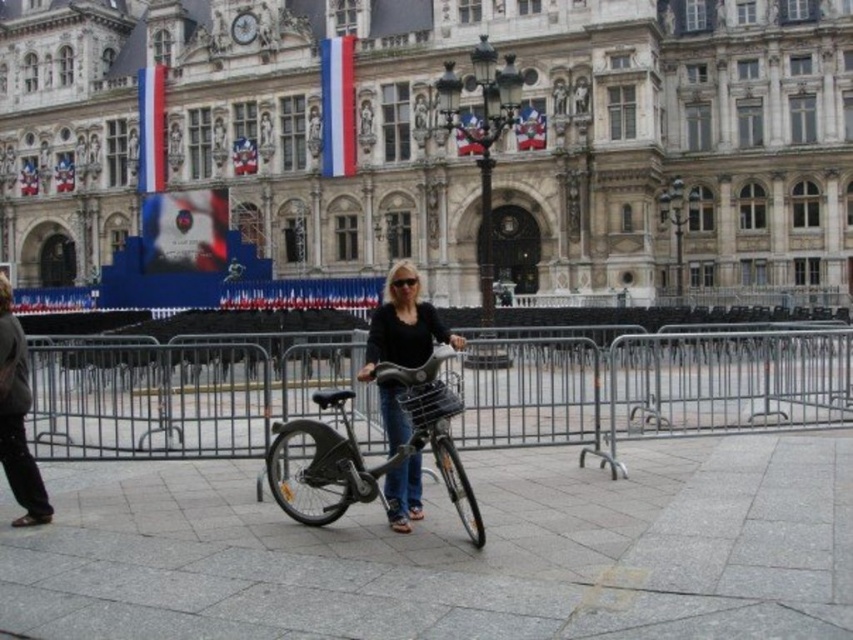
You are standing at the corner of the building and want to choose a bicycle to ride to the nearby park. Which bicycle, the metallic silver bicycle at center or the matte black bicycle at center, would be easier to handle in tight spaces?

The metallic silver bicycle at center has a smaller size compared to the matte black bicycle at center, so it would be easier to handle in tight spaces.

You are standing on the gray stone pavement at center and want to place a metallic silver bicycle at center on it. Will the bicycle be taller than the pavement?

The gray stone pavement at center is not as tall as metallic silver bicycle at center, so yes, the bicycle will be taller than the pavement.